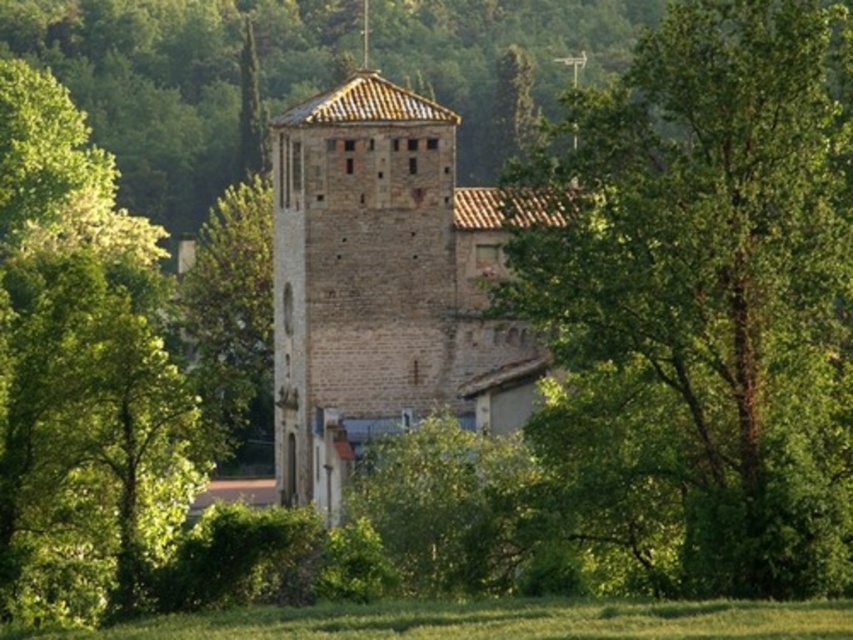
The image size is (853, 640). Describe the element at coordinates (706, 300) in the screenshot. I see `green leafy tree at center` at that location.

This screenshot has width=853, height=640. What are the coordinates of `green leafy tree at center` in the screenshot? It's located at (706, 300).